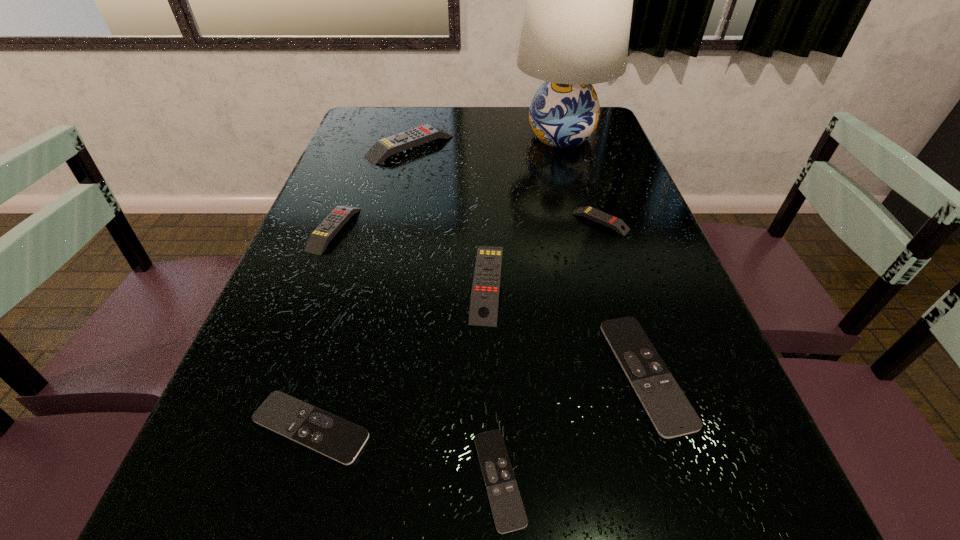
Locate an element on the screen. This screenshot has width=960, height=540. object present at the far left corner is located at coordinates (382, 149).

I want to click on object situated at the far right corner, so click(576, 27).

At what (x,y) coordinates should I click in order to perform the action: click on vacant region at the far edge of the desktop. Please return your answer as a coordinate pair (x, y). The height and width of the screenshot is (540, 960). Looking at the image, I should click on (473, 117).

Locate an element on the screen. free location at the left edge is located at coordinates click(273, 322).

I want to click on free location at the right edge, so click(598, 234).

Locate an element on the screen. Image resolution: width=960 pixels, height=540 pixels. vacant space at the far left corner of the desktop is located at coordinates pyautogui.click(x=366, y=131).

I want to click on free area in between the sixth tallest object and the lampshade, so pyautogui.click(x=603, y=255).

Find the location of a particular element. This screenshot has width=960, height=540. unoccupied position between the third tallest object and the blue lampshade is located at coordinates (524, 210).

Where is `vacant space in between the third tallest object and the fourth tallest object`? vacant space in between the third tallest object and the fourth tallest object is located at coordinates (411, 256).

Image resolution: width=960 pixels, height=540 pixels. Identify the location of free point between the fifth tallest object and the smallest black remote control. (550, 350).